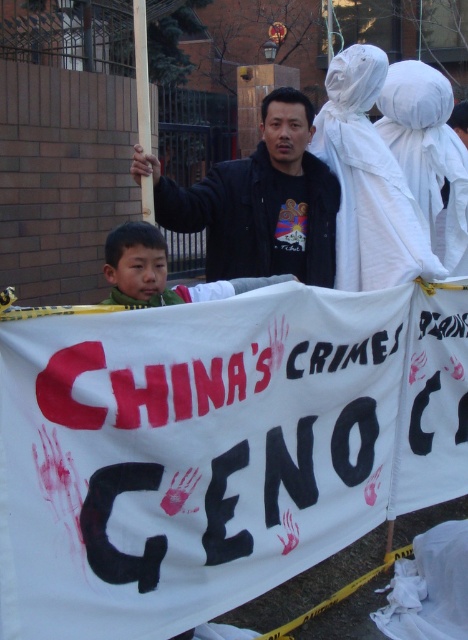
Which is below, black matte jacket at center or green fuzzy jacket at center?

green fuzzy jacket at center is lower down.

Can you confirm if black matte jacket at center is smaller than green fuzzy jacket at center?

Incorrect, black matte jacket at center is not smaller in size than green fuzzy jacket at center.

Does point (327, 236) lie in front of point (219, 284)?

No.

You are a GUI agent. You are given a task and a screenshot of the screen. Output one action in this format:
    pyautogui.click(x=<x>, y=<y>)
    Task: Click on the black matte jacket at center
    The height and width of the screenshot is (640, 468).
    Given the screenshot: What is the action you would take?
    pyautogui.click(x=257, y=198)